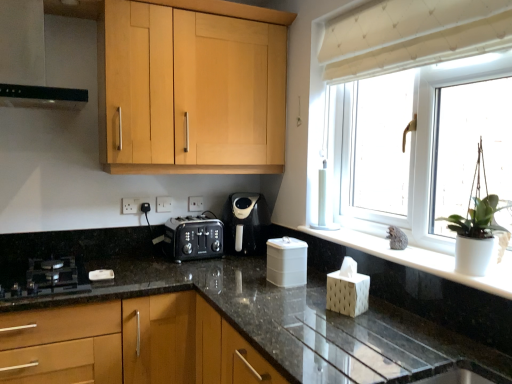
Question: Which direction should I rotate to look at light wood cabinet at upper center, which is counted as the second cabinetry, starting from the bottom?

Choices:
 (A) right
 (B) left

Answer: (B)

Question: Considering the relative sizes of white plastic container at center and white plastic electric outlet at center, the first electric outlet from the right, in the image provided, is white plastic container at center taller than white plastic electric outlet at center, the first electric outlet from the right,?

Choices:
 (A) no
 (B) yes

Answer: (B)

Question: Does white plastic container at center contain white plastic electric outlet at center, the first electric outlet viewed from the back?

Choices:
 (A) yes
 (B) no

Answer: (B)

Question: Can you confirm if white plastic container at center is shorter than white plastic electric outlet at center, the first electric outlet from the right?

Choices:
 (A) yes
 (B) no

Answer: (B)

Question: From a real-world perspective, is white plastic container at center physically below white plastic electric outlet at center, the first electric outlet viewed from the back?

Choices:
 (A) no
 (B) yes

Answer: (B)

Question: From the image's perspective, is white plastic container at center located beneath white plastic electric outlet at center, the second electric outlet viewed from the front?

Choices:
 (A) no
 (B) yes

Answer: (B)

Question: Considering the relative sizes of white plastic container at center and white plastic electric outlet at center, the 2th electric outlet viewed from the left, in the image provided, is white plastic container at center thinner than white plastic electric outlet at center, the 2th electric outlet viewed from the left,?

Choices:
 (A) yes
 (B) no

Answer: (B)

Question: Is the surface of white plastic electric outlet at center, the second electric outlet viewed from the front, in direct contact with black plastic toaster at center?

Choices:
 (A) no
 (B) yes

Answer: (A)

Question: Is white plastic electric outlet at center, the first electric outlet viewed from the back, bigger than black plastic toaster at center?

Choices:
 (A) no
 (B) yes

Answer: (A)

Question: From the image's perspective, is white plastic electric outlet at center, the first electric outlet from the right, on black plastic toaster at center?

Choices:
 (A) no
 (B) yes

Answer: (B)

Question: Does white plastic electric outlet at center, the first electric outlet from the right, have a greater height compared to black plastic toaster at center?

Choices:
 (A) no
 (B) yes

Answer: (A)

Question: Can you confirm if white plastic electric outlet at center, the first electric outlet viewed from the back, is thinner than black plastic toaster at center?

Choices:
 (A) yes
 (B) no

Answer: (A)

Question: Does white plastic electric outlet at center, the second electric outlet viewed from the front, come in front of black plastic toaster at center?

Choices:
 (A) yes
 (B) no

Answer: (B)

Question: Considering the relative sizes of black matte exhaust hood at upper left and white plastic electric outlet at center, the first electric outlet from the right, in the image provided, is black matte exhaust hood at upper left shorter than white plastic electric outlet at center, the first electric outlet from the right,?

Choices:
 (A) no
 (B) yes

Answer: (A)